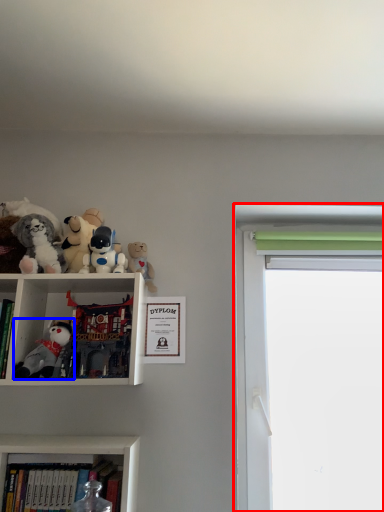
Question: Which point is closer to the camera, window screen (highlighted by a red box) or toy (highlighted by a blue box)?

Choices:
 (A) window screen
 (B) toy

Answer: (B)